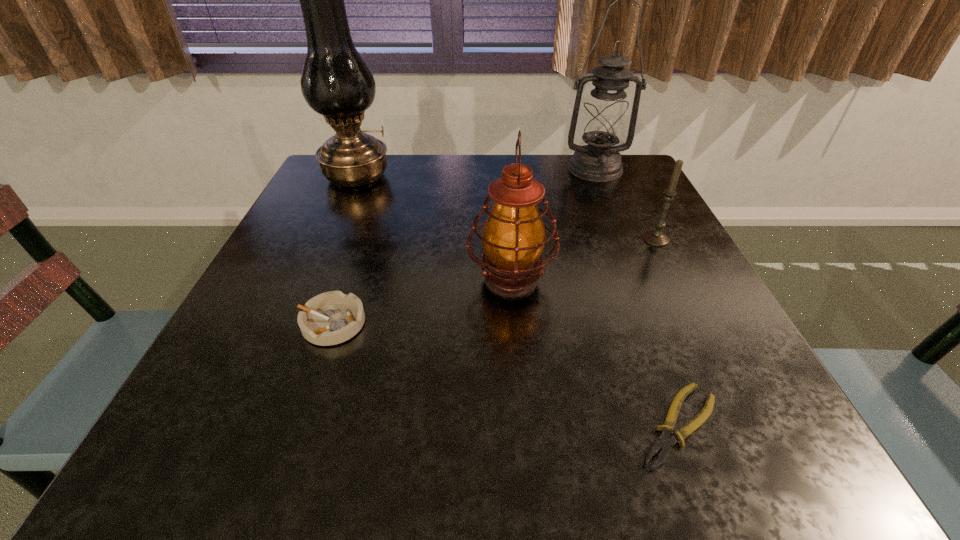
Choose which object is the third nearest neighbor to the rightmost oil lamp. Please provide its 2D coordinates. Your answer should be formatted as a tuple, i.e. [(x, y)], where the tuple contains the x and y coordinates of a point satisfying the conditions above.

[(336, 82)]

Identify which oil lamp is located as the nearest to the second oil lamp from left to right. Please provide its 2D coordinates. Your answer should be formatted as a tuple, i.e. [(x, y)], where the tuple contains the x and y coordinates of a point satisfying the conditions above.

[(604, 118)]

Find the location of a particular element. Image resolution: width=960 pixels, height=540 pixels. the second closest oil lamp to the rightmost oil lamp is located at coordinates [336, 82].

Image resolution: width=960 pixels, height=540 pixels. I want to click on vacant area that satisfies the following two spatial constraints: 1. on the back side of the ashtray; 2. on the right side of the rightmost oil lamp, so click(x=385, y=169).